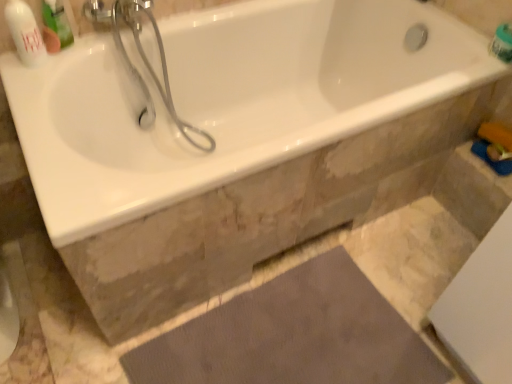
Where is `white glossy bathtub at upper center`? The width and height of the screenshot is (512, 384). white glossy bathtub at upper center is located at coordinates tap(226, 100).

At what (x,y) coordinates should I click in order to perform the action: click on white glossy shower head at upper left. Please return your answer as a coordinate pair (x, y). This screenshot has height=384, width=512. Looking at the image, I should click on (151, 67).

The image size is (512, 384). I want to click on white glossy bottle at upper left, which ranks as the 2th toiletry in right-to-left order, so click(x=25, y=33).

Where is `white glossy bathtub at upper center`? white glossy bathtub at upper center is located at coordinates (226, 100).

Is brown textured mat at lower center spatially inside white glossy bottle at upper left, the first toiletry when ordered from front to back, or outside of it?

brown textured mat at lower center is not inside white glossy bottle at upper left, the first toiletry when ordered from front to back, it's outside.

How distant is brown textured mat at lower center from white glossy bottle at upper left, which ranks as the 2th toiletry in right-to-left order?

They are 3.43 feet apart.

Considering the positions of objects brown textured mat at lower center and white glossy bottle at upper left, the first toiletry when ordered from front to back, in the image provided, who is more to the right, brown textured mat at lower center or white glossy bottle at upper left, the first toiletry when ordered from front to back,?

brown textured mat at lower center.

Considering the sizes of objects white glossy shower head at upper left and green plastic container at upper right, the 1th toiletry in the right-to-left sequence, in the image provided, who is taller, white glossy shower head at upper left or green plastic container at upper right, the 1th toiletry in the right-to-left sequence,?

With more height is white glossy shower head at upper left.

Considering the sizes of white glossy shower head at upper left and green plastic container at upper right, the 1th toiletry in the right-to-left sequence, in the image, is white glossy shower head at upper left bigger or smaller than green plastic container at upper right, the 1th toiletry in the right-to-left sequence,?

In the image, white glossy shower head at upper left appears to be larger than green plastic container at upper right, the 1th toiletry in the right-to-left sequence.

Identify the location of shower on the left of green plastic container at upper right, the 1th toiletry in the right-to-left sequence. Image resolution: width=512 pixels, height=384 pixels. (151, 67).

From a real-world perspective, is white glossy shower head at upper left beneath green plastic container at upper right, the 1th toiletry in the right-to-left sequence?

Yes, from a real-world perspective, white glossy shower head at upper left is below green plastic container at upper right, the 1th toiletry in the right-to-left sequence.

Is brown textured mat at lower center a part of white glossy bathtub at upper center?

No, white glossy bathtub at upper center does not contain brown textured mat at lower center.

From a real-world perspective, which is physically below, white glossy bathtub at upper center or brown textured mat at lower center?

From a 3D spatial view, brown textured mat at lower center is below.

Between white glossy bathtub at upper center and brown textured mat at lower center, which one appears on the left side from the viewer's perspective?

white glossy bathtub at upper center.

Measure the distance between white glossy bathtub at upper center and white glossy bottle at upper left, the first toiletry when ordered from front to back.

The distance of white glossy bathtub at upper center from white glossy bottle at upper left, the first toiletry when ordered from front to back, is 24.44 inches.

Considering the positions of points (441, 64) and (25, 52), is point (441, 64) closer to camera compared to point (25, 52)?

No, it is behind (25, 52).

Considering the positions of objects white glossy bathtub at upper center and white glossy bottle at upper left, the first toiletry when ordered from front to back, in the image provided, who is behind, white glossy bathtub at upper center or white glossy bottle at upper left, the first toiletry when ordered from front to back,?

white glossy bottle at upper left, the first toiletry when ordered from front to back, is more distant.

Where is `bathtub on the right of white glossy bottle at upper left, the first toiletry when ordered from front to back`? This screenshot has height=384, width=512. bathtub on the right of white glossy bottle at upper left, the first toiletry when ordered from front to back is located at coordinates (226, 100).

Considering the relative sizes of brown textured mat at lower center and green plastic mouthwash at upper left in the image provided, is brown textured mat at lower center smaller than green plastic mouthwash at upper left?

Incorrect, brown textured mat at lower center is not smaller in size than green plastic mouthwash at upper left.

Which is further, [181,337] or [54,42]?

The point [181,337] is farther from the camera.

From the image's perspective, is brown textured mat at lower center on top of green plastic mouthwash at upper left?

Actually, brown textured mat at lower center appears below green plastic mouthwash at upper left in the image.

You are a GUI agent. You are given a task and a screenshot of the screen. Output one action in this format:
    pyautogui.click(x=<x>, y=<y>)
    Task: Click on the mouthwash lying above the brown textured mat at lower center (from the image's perspective)
    The height and width of the screenshot is (384, 512).
    Given the screenshot: What is the action you would take?
    pyautogui.click(x=57, y=24)

Can you tell me how much green plastic container at upper right, the 1th toiletry in the right-to-left sequence, and white glossy bathtub at upper center differ in facing direction?

The facing directions of green plastic container at upper right, the 1th toiletry in the right-to-left sequence, and white glossy bathtub at upper center are 89.8 degrees apart.

Does point (497, 38) come in front of point (81, 112)?

No, it is not.

Does green plastic container at upper right, which is the first toiletry from back to front, have a larger size compared to white glossy bathtub at upper center?

Actually, green plastic container at upper right, which is the first toiletry from back to front, might be smaller than white glossy bathtub at upper center.

How far apart are green plastic container at upper right, which is the first toiletry from back to front, and white glossy bathtub at upper center?

green plastic container at upper right, which is the first toiletry from back to front, is 74.53 centimeters from white glossy bathtub at upper center.

Does green plastic container at upper right, the 1th toiletry in the right-to-left sequence, have a lesser height compared to white glossy shower head at upper left?

Correct, green plastic container at upper right, the 1th toiletry in the right-to-left sequence, is not as tall as white glossy shower head at upper left.

Considering the positions of objects green plastic container at upper right, the 1th toiletry in the right-to-left sequence, and white glossy shower head at upper left in the image provided, who is more to the left, green plastic container at upper right, the 1th toiletry in the right-to-left sequence, or white glossy shower head at upper left?

white glossy shower head at upper left.

Is green plastic container at upper right, which is the second toiletry in front-to-back order, situated inside white glossy shower head at upper left or outside?

The correct answer is: outside.

The width and height of the screenshot is (512, 384). Find the location of `shower in front of the green plastic container at upper right, the 1th toiletry in the right-to-left sequence`. shower in front of the green plastic container at upper right, the 1th toiletry in the right-to-left sequence is located at coordinates click(151, 67).

This screenshot has height=384, width=512. There is a brown textured mat at lower center. In order to click on the 2nd toiletry above it (from a real-world perspective) in this screenshot , I will do `click(25, 33)`.

Where is `shower in front of the green plastic container at upper right, the 2th toiletry from the left`? The height and width of the screenshot is (384, 512). shower in front of the green plastic container at upper right, the 2th toiletry from the left is located at coordinates (151, 67).

Looking at the image, which one is located closer to brown textured mat at lower center, white glossy shower head at upper left or white glossy bathtub at upper center?

white glossy bathtub at upper center.

Estimate the real-world distances between objects in this image. Which object is closer to white glossy shower head at upper left, brown textured mat at lower center or green plastic mouthwash at upper left?

Based on the image, green plastic mouthwash at upper left appears to be nearer to white glossy shower head at upper left.

Estimate the real-world distances between objects in this image. Which object is further from brown textured mat at lower center, white glossy bottle at upper left, the first toiletry when ordered from front to back, or white glossy shower head at upper left?

white glossy bottle at upper left, the first toiletry when ordered from front to back.

In the scene shown: From the image, which object appears to be nearer to white glossy shower head at upper left, green plastic mouthwash at upper left or white glossy bathtub at upper center?

green plastic mouthwash at upper left lies closer to white glossy shower head at upper left than the other object.

Which object lies nearer to the anchor point white glossy bathtub at upper center, green plastic mouthwash at upper left or white glossy shower head at upper left?

Among the two, white glossy shower head at upper left is located nearer to white glossy bathtub at upper center.

Considering their positions, is brown textured mat at lower center positioned further to white glossy bottle at upper left, placed as the 2th toiletry when sorted from back to front, than white glossy bathtub at upper center?

Among the two, brown textured mat at lower center is located further to white glossy bottle at upper left, placed as the 2th toiletry when sorted from back to front.

Looking at the image, which one is located further to white glossy bottle at upper left, the first toiletry when ordered from front to back, white glossy shower head at upper left or green plastic mouthwash at upper left?

The object further to white glossy bottle at upper left, the first toiletry when ordered from front to back, is white glossy shower head at upper left.

Estimate the real-world distances between objects in this image. Which object is further from green plastic container at upper right, which is the second toiletry in front-to-back order, white glossy shower head at upper left or brown textured mat at lower center?

The object further to green plastic container at upper right, which is the second toiletry in front-to-back order, is white glossy shower head at upper left.

The width and height of the screenshot is (512, 384). What are the coordinates of `mouthwash situated between white glossy bottle at upper left, placed as the 2th toiletry when sorted from back to front, and white glossy shower head at upper left from left to right` in the screenshot? It's located at tap(57, 24).

Find the location of `bathtub between white glossy bottle at upper left, the first toiletry when ordered from front to back, and brown textured mat at lower center in the up-down direction`. bathtub between white glossy bottle at upper left, the first toiletry when ordered from front to back, and brown textured mat at lower center in the up-down direction is located at coordinates 226,100.

Identify the location of doormat between white glossy bottle at upper left, placed as the 2th toiletry when sorted from back to front, and green plastic container at upper right, which is the second toiletry in front-to-back order, in the horizontal direction. (293, 336).

What are the coordinates of `doormat between green plastic mouthwash at upper left and green plastic container at upper right, the 1th toiletry in the right-to-left sequence` in the screenshot? It's located at (293, 336).